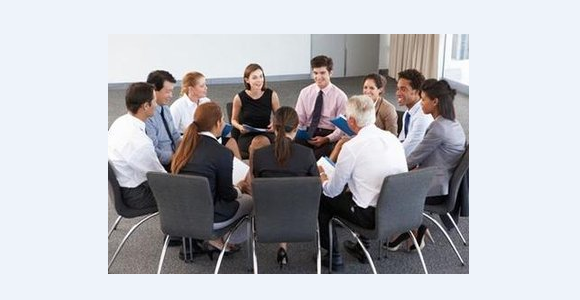
Where is `chairs`? Image resolution: width=580 pixels, height=300 pixels. chairs is located at coordinates (416, 194), (293, 211), (173, 203), (121, 208), (441, 207), (229, 108), (398, 113).